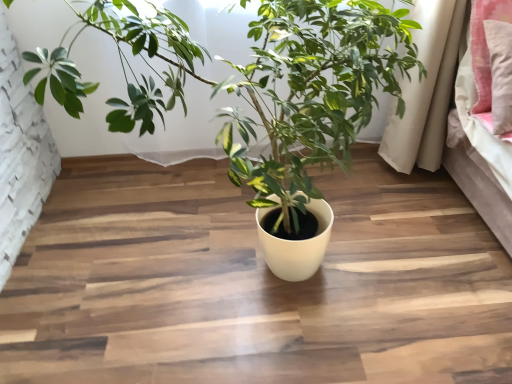
Identify the location of yellow matte pot at center. Image resolution: width=512 pixels, height=384 pixels. 253,83.

What do you see at coordinates (253, 83) in the screenshot? I see `yellow matte pot at center` at bounding box center [253, 83].

Find the location of a particular element. Image resolution: width=512 pixels, height=384 pixels. pink fabric pillow at upper right is located at coordinates (485, 47).

Measure the distance between pink fabric pillow at upper right and camera.

1.20 meters.

The width and height of the screenshot is (512, 384). What do you see at coordinates (485, 47) in the screenshot?
I see `pink fabric pillow at upper right` at bounding box center [485, 47].

Find the location of a particular element. yellow matte pot at center is located at coordinates (253, 83).

Which object is positioned more to the right, yellow matte pot at center or pink fabric pillow at upper right?

pink fabric pillow at upper right is more to the right.

In the image, is yellow matte pot at center positioned in front of or behind pink fabric pillow at upper right?

Visually, yellow matte pot at center is located in front of pink fabric pillow at upper right.

Which is less distant, (279, 41) or (481, 58)?

Point (279, 41)

From the image's perspective, relative to pink fabric pillow at upper right, is yellow matte pot at center above or below?

yellow matte pot at center is situated lower than pink fabric pillow at upper right in the image.

From a real-world perspective, between yellow matte pot at center and pink fabric pillow at upper right, who is vertically higher?

pink fabric pillow at upper right is physically above.

Is yellow matte pot at center wider or thinner than pink fabric pillow at upper right?

yellow matte pot at center is wider than pink fabric pillow at upper right.

Consider the image. Does yellow matte pot at center have a lesser height compared to pink fabric pillow at upper right?

No, yellow matte pot at center is not shorter than pink fabric pillow at upper right.

Based on their sizes in the image, would you say yellow matte pot at center is bigger or smaller than pink fabric pillow at upper right?

yellow matte pot at center is bigger than pink fabric pillow at upper right.

Is yellow matte pot at center inside the boundaries of pink fabric pillow at upper right, or outside?

Result: yellow matte pot at center lies outside pink fabric pillow at upper right.

Is yellow matte pot at center in contact with pink fabric pillow at upper right?

There is a gap between yellow matte pot at center and pink fabric pillow at upper right.

Is yellow matte pot at center positioned with its back to pink fabric pillow at upper right?

yellow matte pot at center is not turned away from pink fabric pillow at upper right.

Locate an element on the screen. pillow located behind the yellow matte pot at center is located at coordinates (485, 47).

Which is more to the right, pink fabric pillow at upper right or yellow matte pot at center?

pink fabric pillow at upper right.

In the scene shown: Which object is further away from the camera, pink fabric pillow at upper right or yellow matte pot at center?

pink fabric pillow at upper right is behind.

Is point (484, 4) closer or farther from the camera than point (253, 98)?

Point (484, 4) is positioned farther from the camera compared to point (253, 98).

From the image's perspective, is pink fabric pillow at upper right under yellow matte pot at center?

Incorrect, from the image's perspective, pink fabric pillow at upper right is higher than yellow matte pot at center.

From a real-world perspective, is pink fabric pillow at upper right under yellow matte pot at center?

No.

Does pink fabric pillow at upper right have a lesser width compared to yellow matte pot at center?

Indeed, pink fabric pillow at upper right has a lesser width compared to yellow matte pot at center.

In the scene shown: Considering the sizes of objects pink fabric pillow at upper right and yellow matte pot at center in the image provided, who is taller, pink fabric pillow at upper right or yellow matte pot at center?

yellow matte pot at center.

Considering the sizes of objects pink fabric pillow at upper right and yellow matte pot at center in the image provided, who is smaller, pink fabric pillow at upper right or yellow matte pot at center?

pink fabric pillow at upper right is smaller.

Is pink fabric pillow at upper right inside the boundaries of yellow matte pot at center, or outside?

pink fabric pillow at upper right is spatially situated outside yellow matte pot at center.

Is pink fabric pillow at upper right beside yellow matte pot at center?

pink fabric pillow at upper right is not next to yellow matte pot at center, and they're not touching.

Is pink fabric pillow at upper right looking in the opposite direction of yellow matte pot at center?

That's not correct — pink fabric pillow at upper right is not looking away from yellow matte pot at center.

How different are the orientations of pink fabric pillow at upper right and yellow matte pot at center in degrees?

3.81e-05 degrees.

From the picture: How distant is pink fabric pillow at upper right from yellow matte pot at center?

pink fabric pillow at upper right is 68.57 centimeters away from yellow matte pot at center.

The image size is (512, 384). Find the location of `pillow that appears above the yellow matte pot at center (from the image's perspective)`. pillow that appears above the yellow matte pot at center (from the image's perspective) is located at coordinates (485, 47).

Find the location of a particular element. houseplant below the pink fabric pillow at upper right (from the image's perspective) is located at coordinates (253, 83).

Image resolution: width=512 pixels, height=384 pixels. I want to click on houseplant lying in front of the pink fabric pillow at upper right, so click(x=253, y=83).